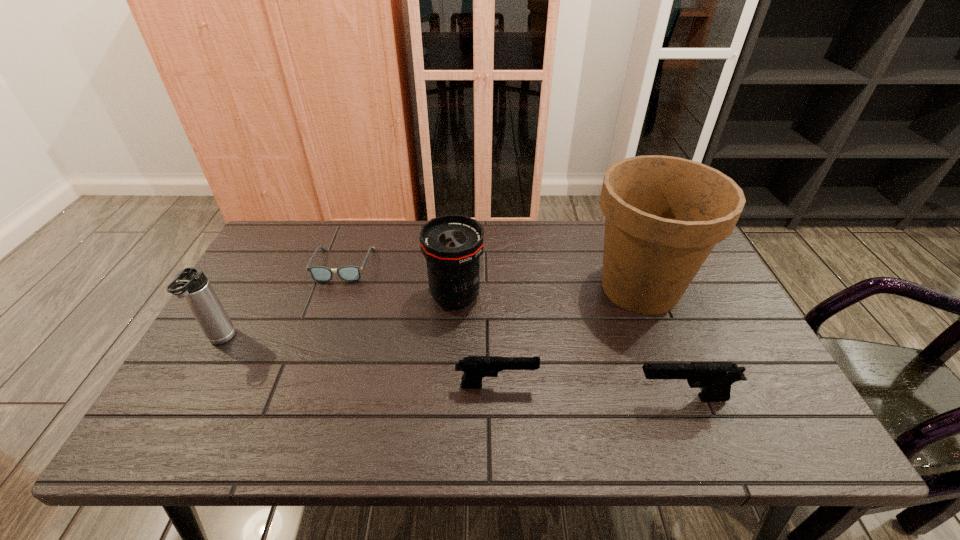
The width and height of the screenshot is (960, 540). I want to click on vacant area that lies between the telephoto lens and the fifth farthest object, so click(x=476, y=341).

At what (x,y) coordinates should I click in order to perform the action: click on vacant space in between the tallest object and the nearest object. Please return your answer as a coordinate pair (x, y). The image size is (960, 540). Looking at the image, I should click on (661, 343).

Where is `free area in between the fifth tallest object and the tallest object`? The width and height of the screenshot is (960, 540). free area in between the fifth tallest object and the tallest object is located at coordinates (568, 336).

You are a GUI agent. You are given a task and a screenshot of the screen. Output one action in this format:
    pyautogui.click(x=<x>, y=<y>)
    Task: Click on the vacant area that lies between the flowerpot and the telephoto lens
    Image resolution: width=960 pixels, height=540 pixels.
    Given the screenshot: What is the action you would take?
    pyautogui.click(x=547, y=292)

At what (x,y) coordinates should I click in order to perform the action: click on free point between the leftmost object and the second nearest object. Please return your answer as a coordinate pair (x, y). Looking at the image, I should click on point(358,363).

Find the location of a particular element. This screenshot has height=540, width=960. vacant space in between the telephoto lens and the right pistol is located at coordinates (568, 347).

Locate an element on the screen. The width and height of the screenshot is (960, 540). vacant region between the nearer pistol and the tallest object is located at coordinates (661, 343).

Locate an element on the screen. Image resolution: width=960 pixels, height=540 pixels. free spot between the tallest object and the left pistol is located at coordinates (568, 336).

Find the location of a particular element. The height and width of the screenshot is (540, 960). vacant space that is in between the spectacles and the taller pistol is located at coordinates (513, 332).

Locate an element on the screen. object that is the fourth nearest to the second object from left to right is located at coordinates (663, 215).